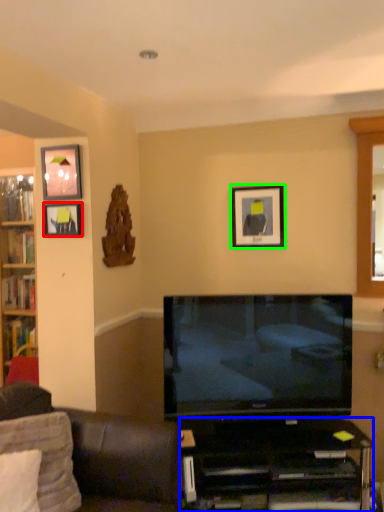
Question: Which is nearer to the picture frame (highlighted by a red box)? desk (highlighted by a blue box) or picture frame (highlighted by a green box).

Choices:
 (A) desk
 (B) picture frame

Answer: (B)